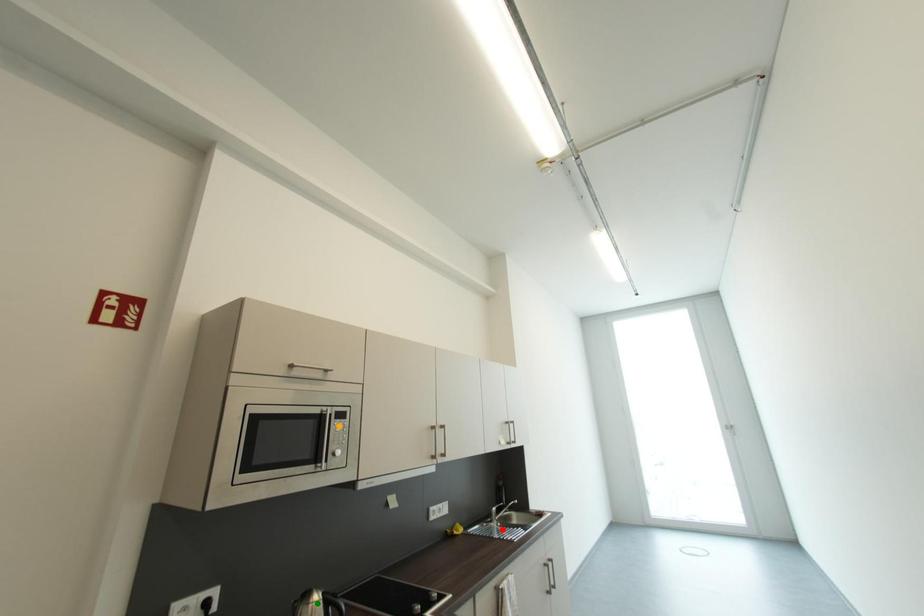
Order these from nearest to farthest:
- orange point
- red point
- green point

green point, orange point, red point